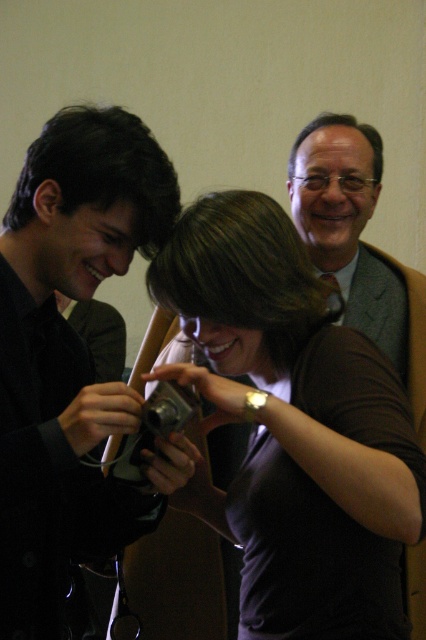
Question: Can you confirm if matte black camera at center is positioned to the left of matte black camera at left?

Choices:
 (A) yes
 (B) no

Answer: (B)

Question: Is matte black camera at center above matte black camera at left?

Choices:
 (A) yes
 (B) no

Answer: (B)

Question: Can you confirm if matte black camera at center is positioned above matte black camera at left?

Choices:
 (A) no
 (B) yes

Answer: (A)

Question: Which object appears closest to the camera in this image?

Choices:
 (A) matte black camera at left
 (B) matte black camera at center

Answer: (A)

Question: Which point is closer to the camera?

Choices:
 (A) (293, 582)
 (B) (121, 508)

Answer: (A)